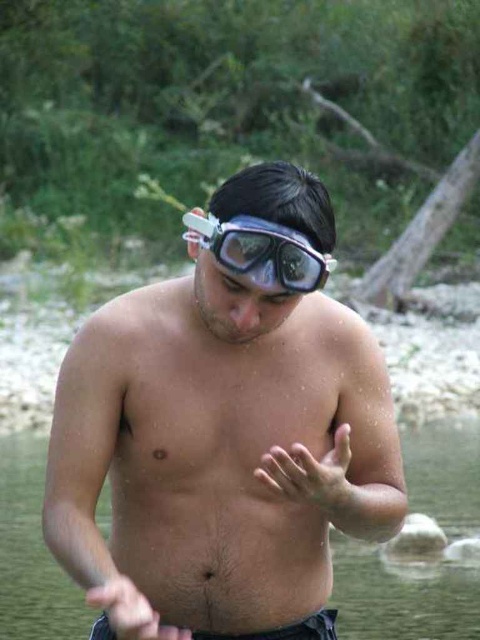
You are a lifeguard observing a person in a river. You notice two hands at the center of your view, labeled as pale skin hand at center and smooth skin hand at center. Which hand is narrower in width?

The pale skin hand at center is narrower in width compared to the smooth skin hand at center.

You are standing on the bank of a river and see the clear plastic goggles at center floating in the water. You need to retrieve them without getting your clothes wet. Can you reach them from where you are standing?

The clear plastic goggles at center are 3.03 meters away from viewer, so you cannot reach them from where you are standing without getting your clothes wet.

You are a photographer taking a closeup shot of the hands in the scene. You notice two hands at the center of the image labeled as pale skin hand at center and smooth skin hand at center. Which hand is positioned to the right side in the frame?

The pale skin hand at center is positioned to the right of the smooth skin hand at center according to the description.